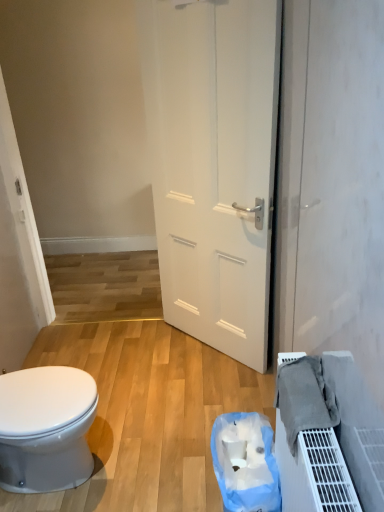
Question: Is white glossy bidet at lower left situated inside white matte door at center or outside?

Choices:
 (A) inside
 (B) outside

Answer: (B)

Question: Is white glossy bidet at lower left wider or thinner than white matte door at center?

Choices:
 (A) wide
 (B) thin

Answer: (A)

Question: Considering the real-world distances, which object is farthest from the white glossy bidet at lower left?

Choices:
 (A) blue plastic bag at lower center
 (B) gray fabric at lower right
 (C) white matte door at center

Answer: (C)

Question: Based on their relative distances, which object is nearer to the blue plastic bag at lower center?

Choices:
 (A) white glossy bidet at lower left
 (B) gray fabric at lower right
 (C) white matte door at center

Answer: (B)